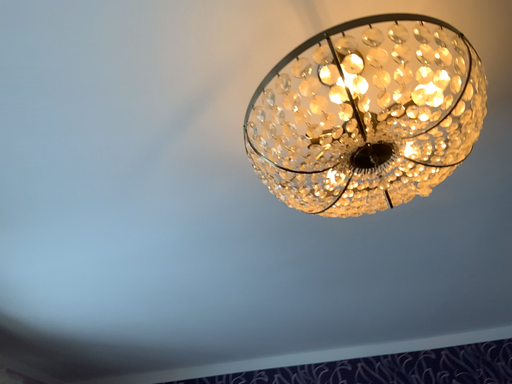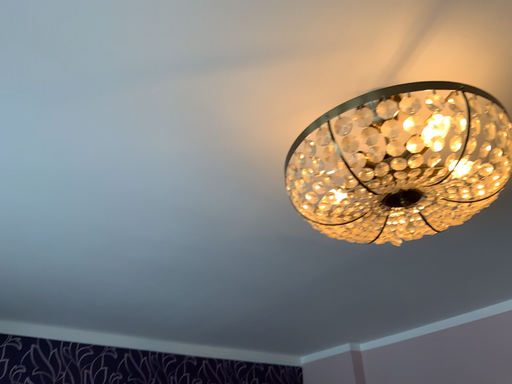
Question: How did the camera likely rotate when shooting the video?

Choices:
 (A) rotated upward
 (B) rotated downward

Answer: (B)